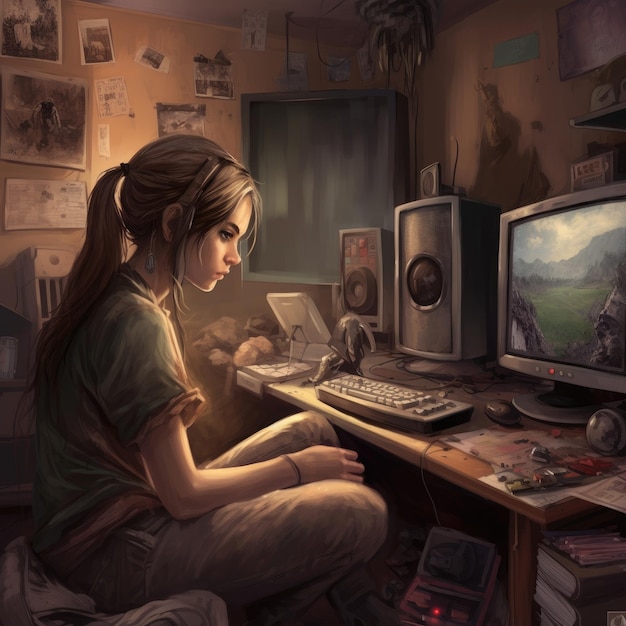
At what (x,y) coordinates should I click in order to perform the action: click on speaker. Please return your answer as a coordinate pair (x, y). The height and width of the screenshot is (626, 626). Looking at the image, I should click on (347, 270), (447, 295).